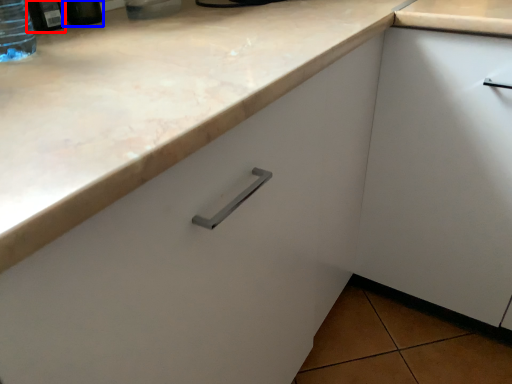
Question: Among these objects, which one is nearest to the camera, bottle (highlighted by a red box) or bottle (highlighted by a blue box)?

Choices:
 (A) bottle
 (B) bottle

Answer: (A)